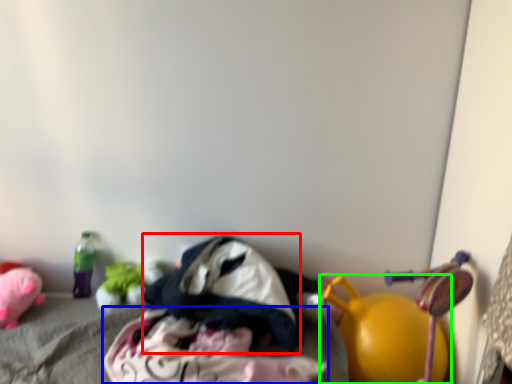
Question: Considering the real-world distances, which object is farthest from clothing (highlighted by a red box)? clothing (highlighted by a blue box) or toy (highlighted by a green box)?

Choices:
 (A) clothing
 (B) toy

Answer: (B)